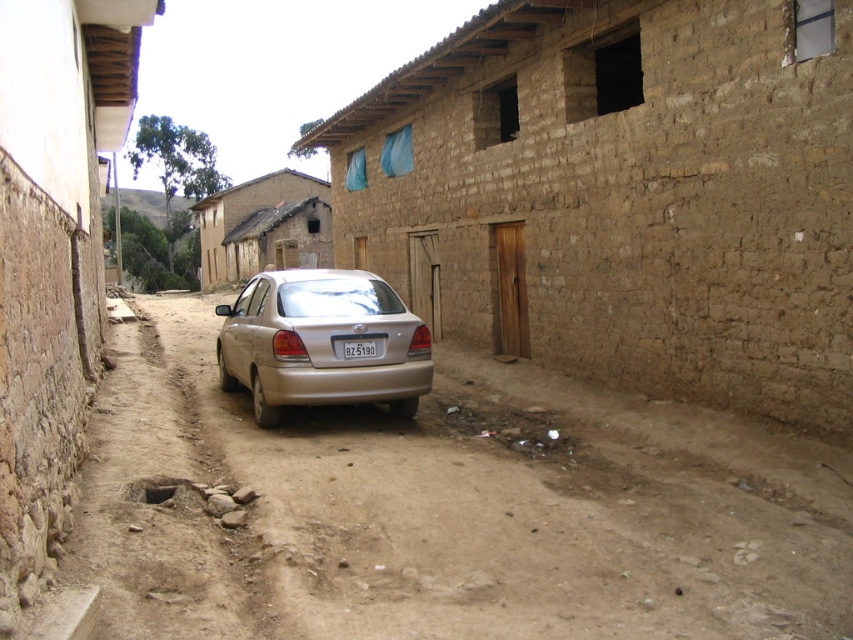
Question: Considering the real-world distances, which object is farthest from the gold metallic car at center?

Choices:
 (A) brown dirt track at center
 (B) white plastic license plate at center

Answer: (A)

Question: Can you confirm if brown dirt track at center is positioned to the right of white plastic license plate at center?

Choices:
 (A) no
 (B) yes

Answer: (B)

Question: Can you confirm if brown dirt track at center is wider than white plastic license plate at center?

Choices:
 (A) no
 (B) yes

Answer: (B)

Question: Which point is farther to the camera?

Choices:
 (A) white plastic license plate at center
 (B) brown dirt track at center
 (C) gold metallic car at center

Answer: (C)

Question: Estimate the real-world distances between objects in this image. Which object is farther from the white plastic license plate at center?

Choices:
 (A) brown dirt track at center
 (B) gold metallic car at center

Answer: (A)

Question: In this image, where is gold metallic car at center located relative to white plastic license plate at center?

Choices:
 (A) above
 (B) below

Answer: (B)